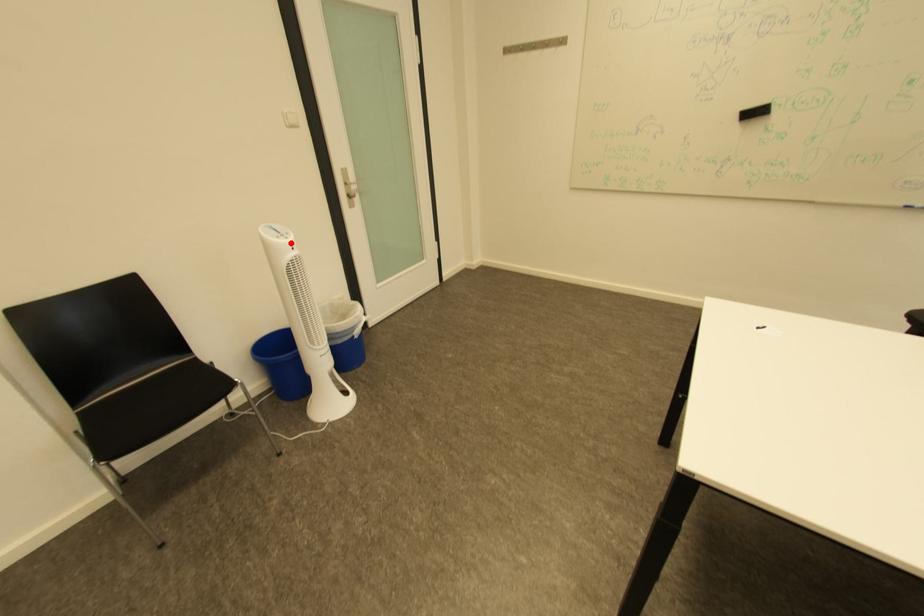
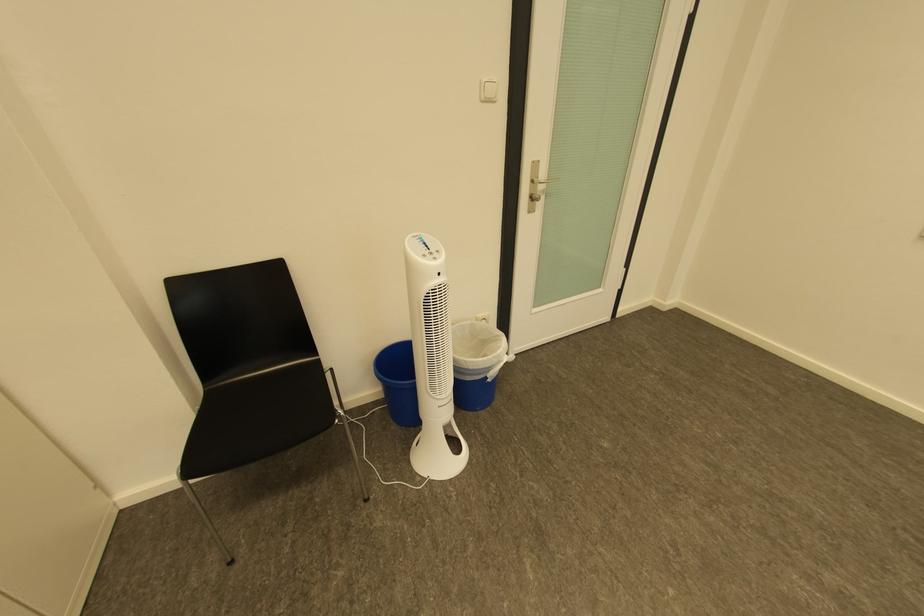
The point at the highlighted location is marked in the first image. Where is the corresponding point in the second image?

(439, 262)